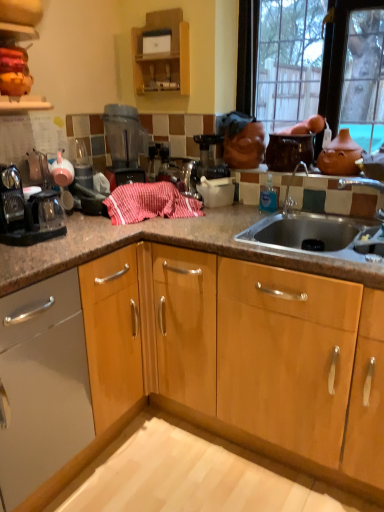
Question: Is matte black coffee maker at left wider than terracotta clay teapot at upper right?

Choices:
 (A) no
 (B) yes

Answer: (B)

Question: From the image's perspective, is matte black coffee maker at left beneath terracotta clay teapot at upper right?

Choices:
 (A) no
 (B) yes

Answer: (B)

Question: Is matte black coffee maker at left not close to terracotta clay teapot at upper right?

Choices:
 (A) yes
 (B) no

Answer: (A)

Question: Considering the relative positions of matte black coffee maker at left and terracotta clay teapot at upper right in the image provided, is matte black coffee maker at left to the left of terracotta clay teapot at upper right from the viewer's perspective?

Choices:
 (A) no
 (B) yes

Answer: (B)

Question: Is matte black coffee maker at left at the right side of terracotta clay teapot at upper right?

Choices:
 (A) no
 (B) yes

Answer: (A)

Question: From the image's perspective, is matte glass window at upper right above or below terracotta clay teapot at upper right?

Choices:
 (A) above
 (B) below

Answer: (A)

Question: In the image, is matte glass window at upper right positioned in front of or behind terracotta clay teapot at upper right?

Choices:
 (A) behind
 (B) front

Answer: (B)

Question: Based on their sizes in the image, would you say matte glass window at upper right is bigger or smaller than terracotta clay teapot at upper right?

Choices:
 (A) big
 (B) small

Answer: (A)

Question: Is matte glass window at upper right taller or shorter than terracotta clay teapot at upper right?

Choices:
 (A) short
 (B) tall

Answer: (B)

Question: From a real-world perspective, is terracotta clay teapot at upper right physically located above or below matte black coffee maker at left?

Choices:
 (A) above
 (B) below

Answer: (A)

Question: Considering the positions of terracotta clay teapot at upper right and matte black coffee maker at left in the image, is terracotta clay teapot at upper right taller or shorter than matte black coffee maker at left?

Choices:
 (A) tall
 (B) short

Answer: (B)

Question: Is terracotta clay teapot at upper right inside the boundaries of matte black coffee maker at left, or outside?

Choices:
 (A) inside
 (B) outside

Answer: (B)

Question: Relative to matte black coffee maker at left, is terracotta clay teapot at upper right in front or behind?

Choices:
 (A) front
 (B) behind

Answer: (B)

Question: Is red striped cloth at center wider or thinner than wooden cabinet at upper center?

Choices:
 (A) wide
 (B) thin

Answer: (A)

Question: From a real-world perspective, is red striped cloth at center above or below wooden cabinet at upper center?

Choices:
 (A) above
 (B) below

Answer: (B)